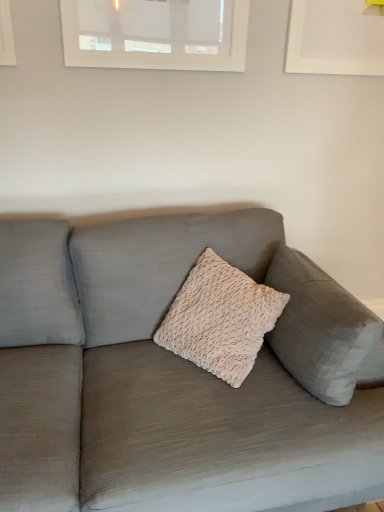
Question: Is white textured window at upper center wider or thinner than matte gray couch at center?

Choices:
 (A) wide
 (B) thin

Answer: (B)

Question: From a real-world perspective, is white textured window at upper center positioned above or below matte gray couch at center?

Choices:
 (A) above
 (B) below

Answer: (A)

Question: Relative to matte gray couch at center, is white textured window at upper center in front or behind?

Choices:
 (A) behind
 (B) front

Answer: (A)

Question: From a real-world perspective, is matte gray couch at center positioned above or below white textured window at upper center?

Choices:
 (A) below
 (B) above

Answer: (A)

Question: Looking at the image, does matte gray couch at center seem bigger or smaller compared to white textured window at upper center?

Choices:
 (A) small
 (B) big

Answer: (B)

Question: Considering their positions, is matte gray couch at center located in front of or behind white textured window at upper center?

Choices:
 (A) front
 (B) behind

Answer: (A)

Question: Visually, is matte gray couch at center positioned to the left or to the right of white textured window at upper center?

Choices:
 (A) right
 (B) left

Answer: (A)